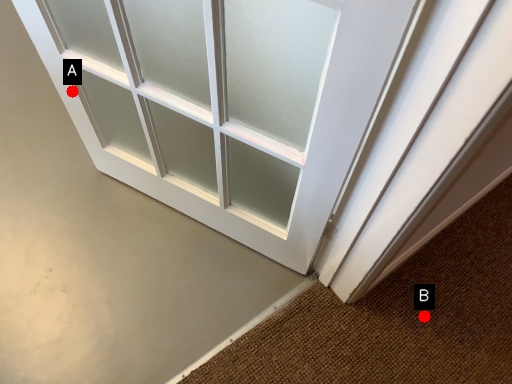
Question: Two points are circled on the image, labeled by A and B beside each circle. Which point is farther from the camera taking this photo?

Choices:
 (A) A is further
 (B) B is further

Answer: (B)